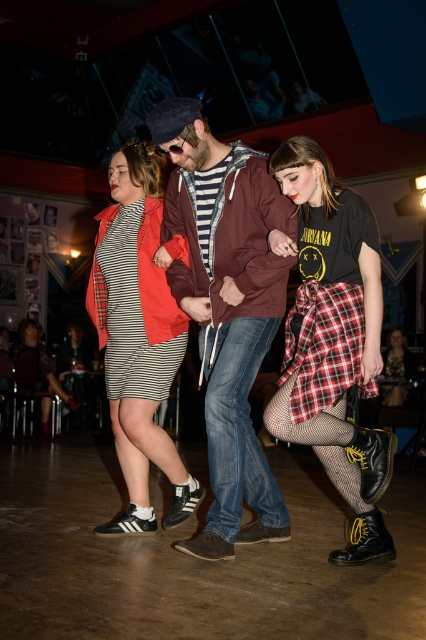
Is plaid fabric skirt at center bigger than white leather sneakers at center?

Actually, plaid fabric skirt at center might be smaller than white leather sneakers at center.

Can you confirm if plaid fabric skirt at center is smaller than white leather sneakers at center?

Indeed, plaid fabric skirt at center has a smaller size compared to white leather sneakers at center.

Which is behind, point (322, 417) or point (150, 422)?

The point (150, 422) is more distant.

Where is `plaid fabric skirt at center`? This screenshot has height=640, width=426. plaid fabric skirt at center is located at coordinates (333, 337).

Is matte maroon hoodie at center closer to camera compared to striped cotton dress at center?

That is True.

Is matte maroon hoodie at center further to the viewer compared to striped cotton dress at center?

No, it is in front of striped cotton dress at center.

This screenshot has width=426, height=640. Identify the location of matte maroon hoodie at center. (226, 308).

This screenshot has height=640, width=426. What are the coordinates of `matte maroon hoodie at center` in the screenshot? It's located at (226, 308).

Is matte black shoes at center positioned behind matte maroon hoodie at center?

No, it is in front of matte maroon hoodie at center.

Does matte black shoes at center have a lesser width compared to matte maroon hoodie at center?

No, matte black shoes at center is not thinner than matte maroon hoodie at center.

The height and width of the screenshot is (640, 426). In order to click on matte black shoes at center in this screenshot , I will do `click(227, 307)`.

Where is `matte black shoes at center`? This screenshot has width=426, height=640. matte black shoes at center is located at coordinates (227, 307).